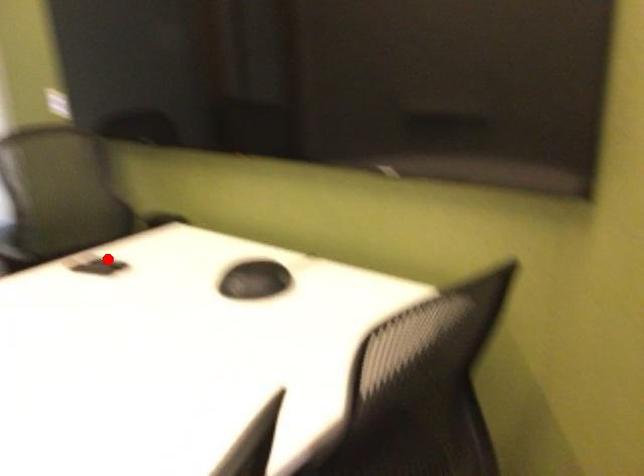
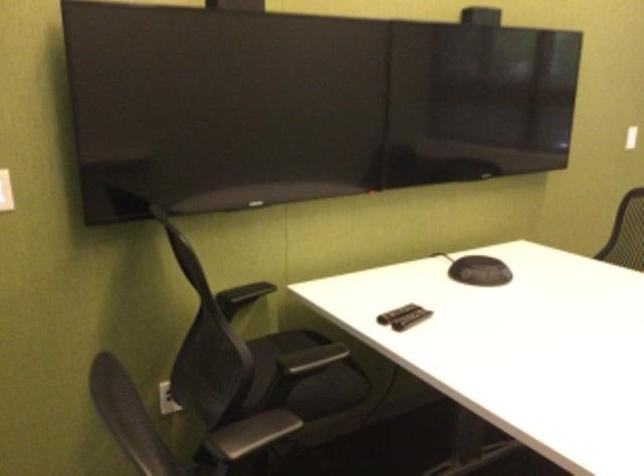
In the second image, find the point that corresponds to the highlighted location in the first image.

(395, 313)